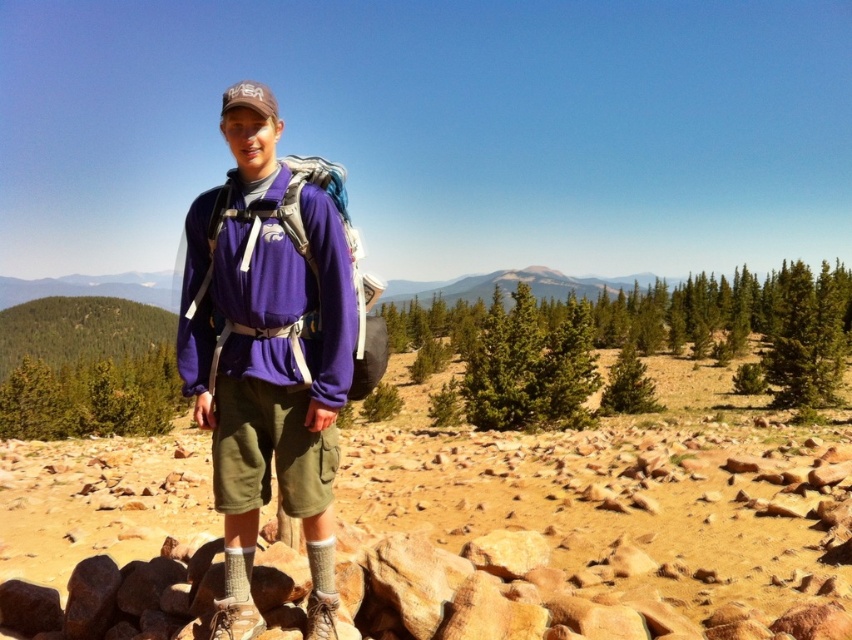
Question: Which object is farther from the camera taking this photo?

Choices:
 (A) matte purple backpack at center
 (B) purple fleece jacket at center

Answer: (B)

Question: Is the position of purple fleece jacket at center more distant than that of matte purple backpack at center?

Choices:
 (A) yes
 (B) no

Answer: (A)

Question: Which object appears farthest from the camera in this image?

Choices:
 (A) matte purple backpack at center
 (B) purple fleece jacket at center

Answer: (B)

Question: Among these objects, which one is farthest from the camera?

Choices:
 (A) purple fleece jacket at center
 (B) matte purple backpack at center

Answer: (A)

Question: Can you confirm if purple fleece jacket at center is thinner than matte purple backpack at center?

Choices:
 (A) yes
 (B) no

Answer: (B)

Question: Is purple fleece jacket at center below matte purple backpack at center?

Choices:
 (A) yes
 (B) no

Answer: (B)